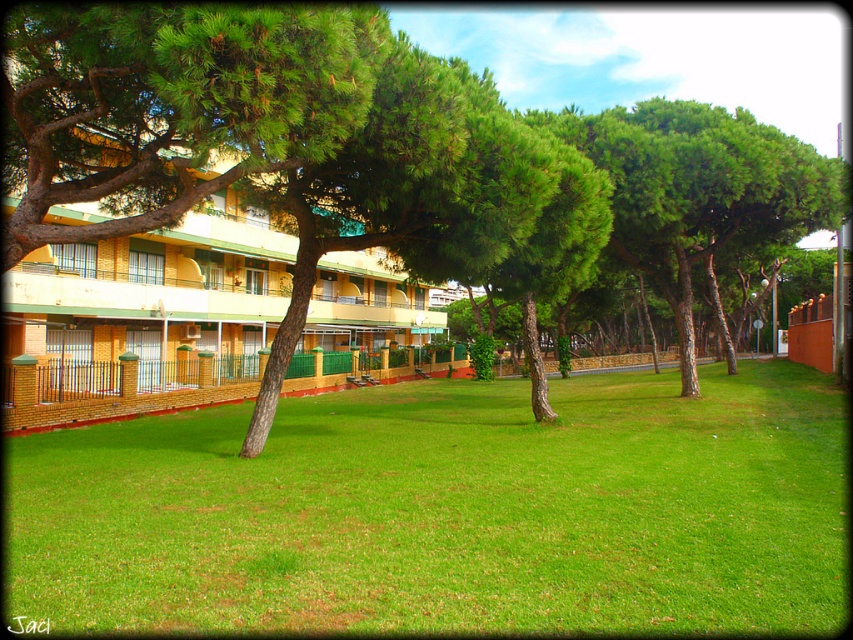
Question: Which object is farther from the camera taking this photo?

Choices:
 (A) green grass at center
 (B) yellow wood hotel at left

Answer: (B)

Question: Which point is closer to the camera taking this photo?

Choices:
 (A) (386, 500)
 (B) (113, 332)

Answer: (A)

Question: Is the position of green grass at center less distant than that of yellow wood hotel at left?

Choices:
 (A) yes
 (B) no

Answer: (A)

Question: Is green grass at center positioned at the back of yellow wood hotel at left?

Choices:
 (A) yes
 (B) no

Answer: (B)

Question: Which point is farther to the camera?

Choices:
 (A) (440, 403)
 (B) (422, 285)

Answer: (B)

Question: Does green grass at center appear under yellow wood hotel at left?

Choices:
 (A) yes
 (B) no

Answer: (A)